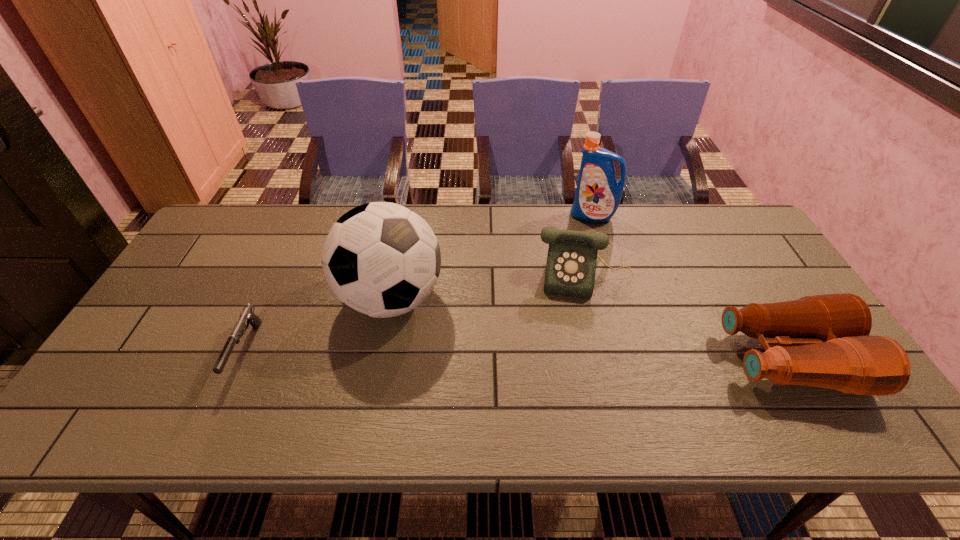
Find the location of a particular element. The height and width of the screenshot is (540, 960). free spot on the desktop that is between the leftmost object and the binoculars and is positioned on the label of the farthest object is located at coordinates (515, 355).

Where is `free spot on the desktop that is between the leftmost object and the rightmost object and is positioned on the main logo of the soccer ball`? Image resolution: width=960 pixels, height=540 pixels. free spot on the desktop that is between the leftmost object and the rightmost object and is positioned on the main logo of the soccer ball is located at coordinates (498, 355).

Locate an element on the screen. vacant spot on the desktop that is between the leftmost object and the binoculars and is positioned on the dial of the telephone is located at coordinates (585, 356).